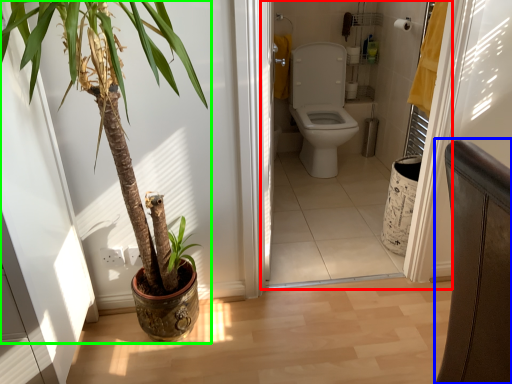
Question: Estimate the real-world distances between objects in this image. Which object is closer to corridor (highlighted by a red box), chair (highlighted by a blue box) or houseplant (highlighted by a green box)?

Choices:
 (A) chair
 (B) houseplant

Answer: (B)